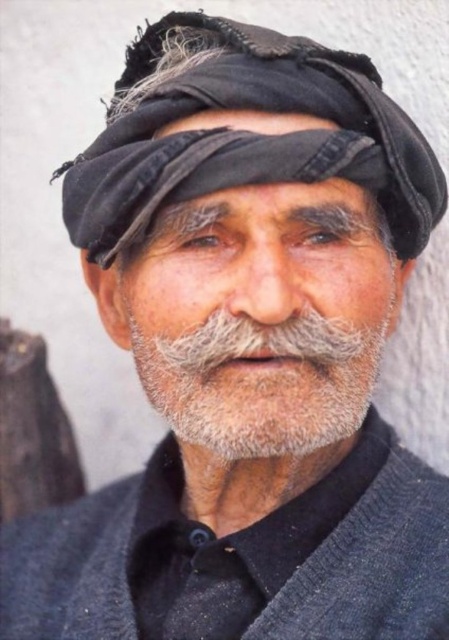
You are taking a photo of an elderly man wearing a dark headscarf and a dark garment. You notice two points on his face at coordinates point [65,200] and point [278,132]. Which point is closer to the camera?

Point [65,200] is further to the camera than point [278,132], so the point closer to the camera is point [278,132].